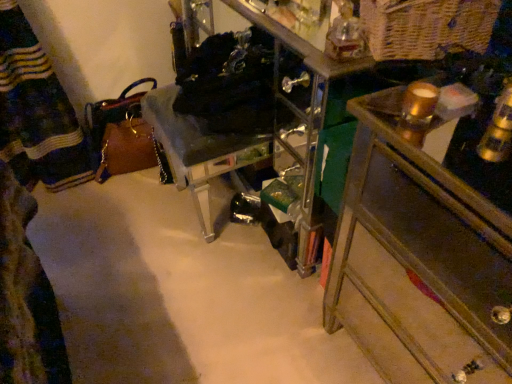
Image resolution: width=512 pixels, height=384 pixels. What are the coordinates of `free space in front of clear acrylic chair at center` in the screenshot? It's located at (206, 285).